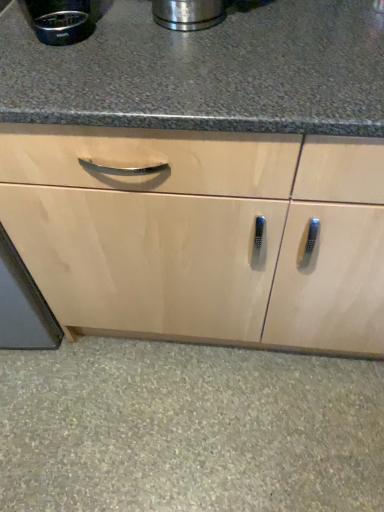
What are the coordinates of `vacant point above natural stone floor at lower center (from a real-world perspective)` in the screenshot? It's located at (175, 405).